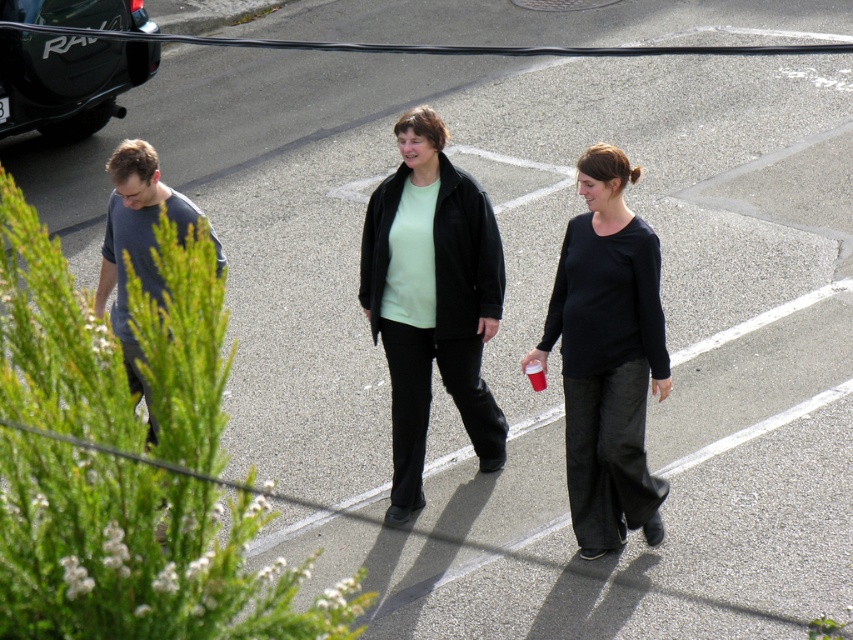
You are standing on the road and see two points marked on the ground. The first point is labeled as point (467, 426) and the second is point (115, 205). Which point is closer to you?

Point (467, 426) is closer to you because it is further to the viewer than point (115, 205).

You are a pedestrian trying to cross the road. You see a matte black jacket at center and a matte black suv at upper left. Which one is closer to the left side of the road?

The matte black suv at upper left is closer to the left side of the road because the matte black jacket at center is positioned on the right side of it.

You are a photographer trying to capture a candid shot of the two people in the center of the image. You notice that the matte black jacket at center and the black matte shirt at center are positioned close to each other. Which one is positioned higher in the frame?

The matte black jacket at center is located above the black matte shirt at center, so it is positioned higher in the frame.